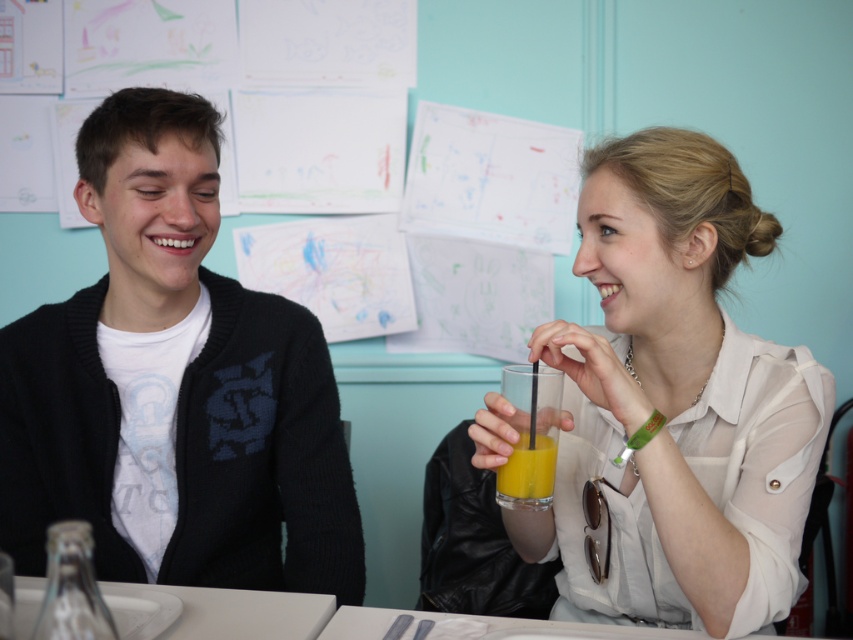
You are an interior designer analyzing the wall decorations in the scene. The matte white blouse at center is located at coordinates point 0.627, 0.797. Can you determine if the blouse is positioned closer to the top or bottom of the wall?

The coordinates are given as point (679, 401). The vertical position is determined by the second value, 0.797, which indicates the blouse is closer to the bottom of the wall since 0.797 is closer to 1.0 than to 0.0 in a typical coordinate system where 0.0 is the top and 1.0 is the bottom.

From the picture: You are standing in front of the wall with drawings and want to take a photo of the point at coordinates (599, 419). The camera you are using has a minimum focus distance of 1.1 meters. Will the point be in focus?

The point at coordinates (599, 419) is 1.09 meters from the camera, which is closer than the minimum focus distance of 1.1 meters. Therefore, the point will not be in focus.